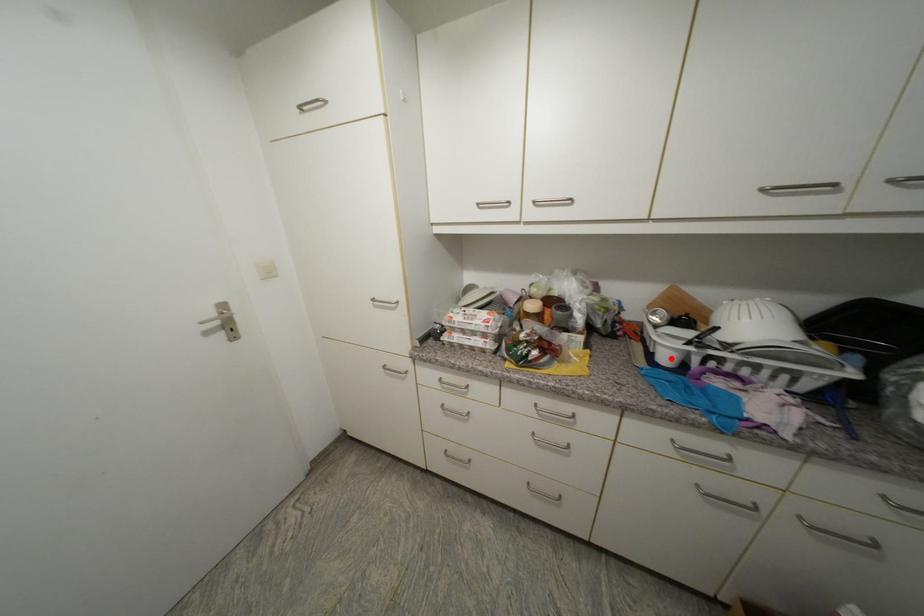
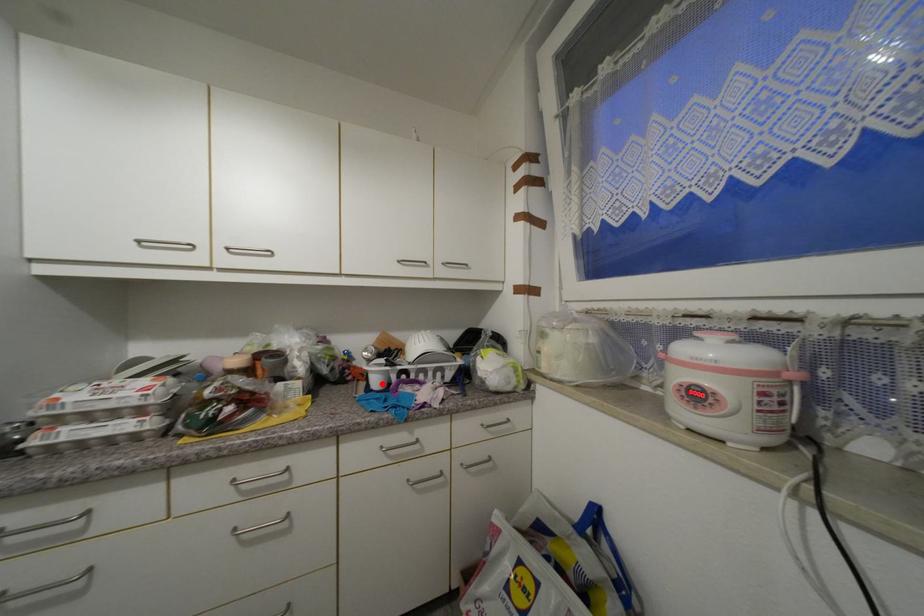
I am providing you with two images of the same scene from different viewpoints. A red point is marked on the first image and another point is marked on the second image. Does the point marked in image1 correspond to the same location as the one in image2?

Yes